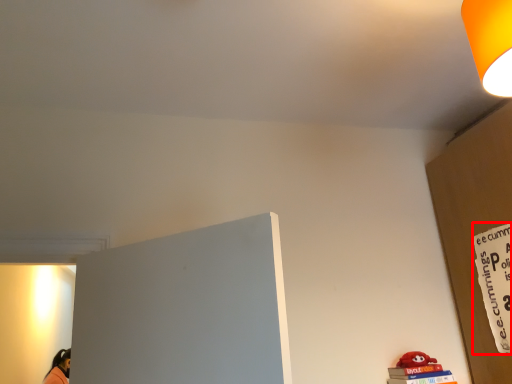
Question: From the image, what is the correct spatial relationship of warning sign (annotated by the red box) in relation to lamp?

Choices:
 (A) right
 (B) left

Answer: (A)